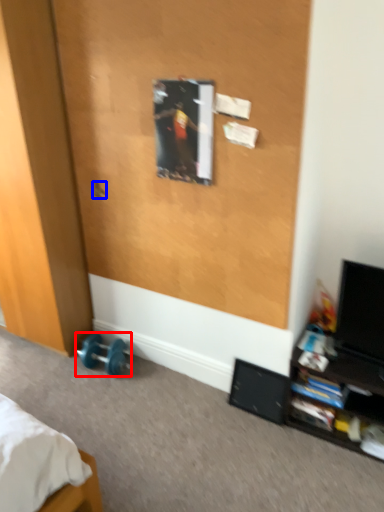
Question: Which of the following is the closest to the observer, dumbbell (highlighted by a red box) or door handle (highlighted by a blue box)?

Choices:
 (A) dumbbell
 (B) door handle

Answer: (B)